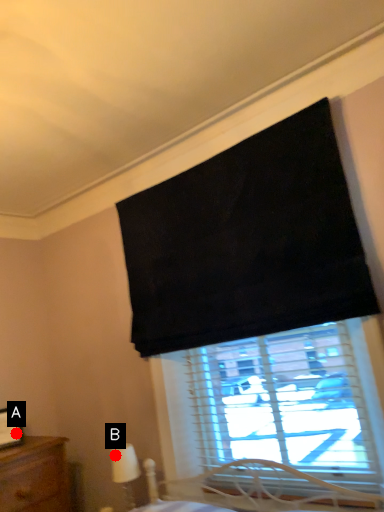
Question: Two points are circled on the image, labeled by A and B beside each circle. Among these points, which one is nearest to the camera?

Choices:
 (A) A is closer
 (B) B is closer

Answer: (A)